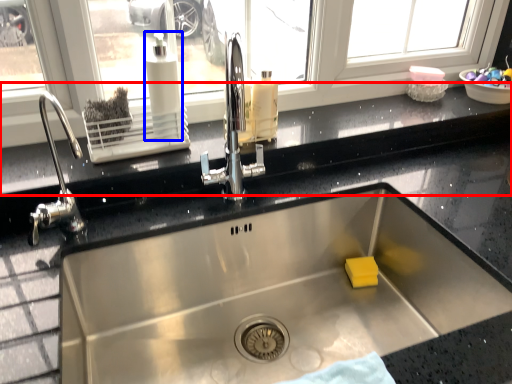
Question: Among these objects, which one is nearest to the camera, window sill (highlighted by a red box) or soap dispenser (highlighted by a blue box)?

Choices:
 (A) window sill
 (B) soap dispenser

Answer: (A)